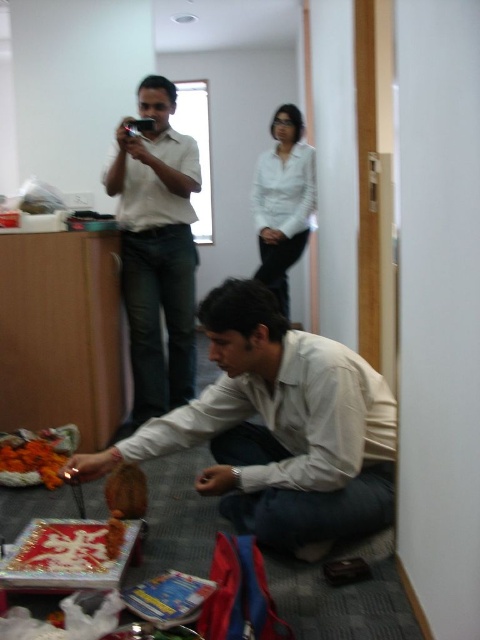
Can you confirm if matte white shirt at upper left is shorter than orange floral decoration at lower left?

No.

Find the location of a particular element. Image resolution: width=480 pixels, height=640 pixels. matte white shirt at upper left is located at coordinates (156, 250).

You are a GUI agent. You are given a task and a screenshot of the screen. Output one action in this format:
    pyautogui.click(x=<x>, y=<y>)
    Task: Click on the matte white shirt at upper left
    
    Given the screenshot: What is the action you would take?
    pyautogui.click(x=156, y=250)

Looking at this image, measure the distance between matte white shirt at lower center and brown matte cake at lower center.

matte white shirt at lower center is 17.77 inches from brown matte cake at lower center.

Is matte white shirt at lower center shorter than brown matte cake at lower center?

No.

Is point (288, 401) behind point (143, 477)?

No, (288, 401) is in front of (143, 477).

Find the location of `matte white shirt at lower center`. matte white shirt at lower center is located at coordinates (278, 428).

Is matte white shirt at upper left bigger than white glossy shirt at upper center?

Correct, matte white shirt at upper left is larger in size than white glossy shirt at upper center.

Looking at this image, which is below, matte white shirt at upper left or white glossy shirt at upper center?

matte white shirt at upper left is lower down.

Who is more distant from viewer, (153, 372) or (279, 246)?

The point (279, 246) is more distant.

Locate an element on the screen. The image size is (480, 640). matte white shirt at upper left is located at coordinates (156, 250).